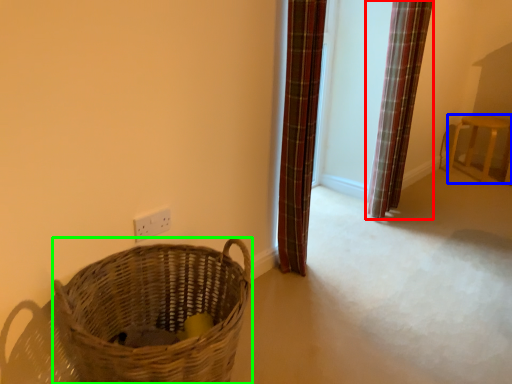
Question: Considering the real-world distances, which object is closest to curtain (highlighted by a red box)? furniture (highlighted by a blue box) or basket (highlighted by a green box).

Choices:
 (A) furniture
 (B) basket

Answer: (A)